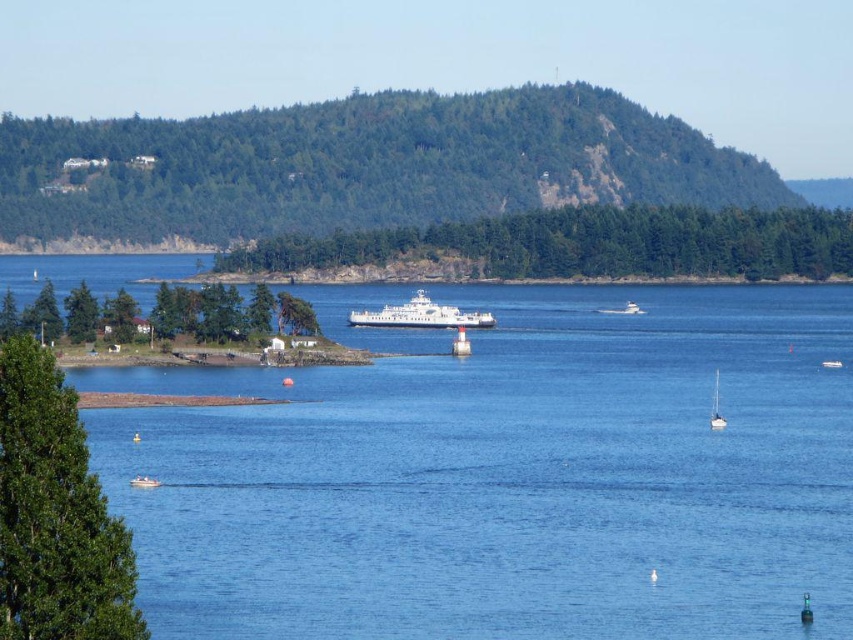
You are a photographer standing at the shore of the bay. You want to capture both the white glossy sailboat at lower right and the white plastic boat at lower left in your photo. Which boat should you position closer to the center of the frame to include both in the shot?

The white glossy sailboat at lower right is positioned over the white plastic boat at lower left, so to include both in the shot, you should position the white glossy sailboat at lower right closer to the center of the frame.

You are planning to dock your boat at the shore. You have two options for docking spots. The first is near the white plastic boat at lower left, and the second is near the white matte boat at center. Which dock has more space available for your boat?

The dock near the white matte boat at center has more space available because the white plastic boat at lower left occupies less space than the white matte boat at center, implying the latter takes up more space, leaving less room at its dock.